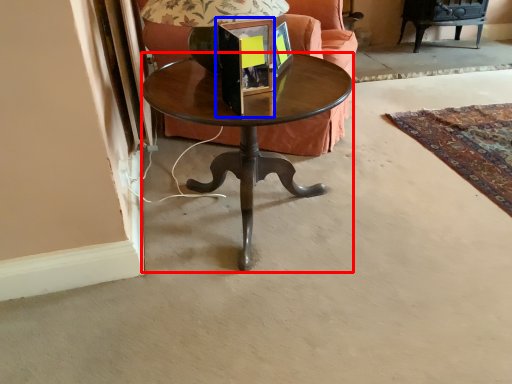
Question: Which object is further to the camera taking this photo, coffee table (highlighted by a red box) or picture frame (highlighted by a blue box)?

Choices:
 (A) coffee table
 (B) picture frame

Answer: (A)